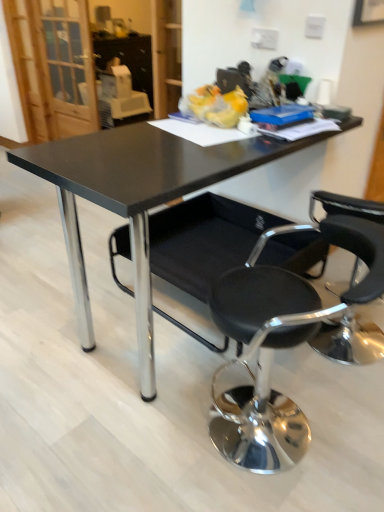
Question: Is black leather chair at lower right, which is counted as the 2th chair, starting from the back, inside the boundaries of black fabric chair at center, which is counted as the 1th chair, starting from the back, or outside?

Choices:
 (A) outside
 (B) inside

Answer: (A)

Question: Looking at their shapes, would you say black leather chair at lower right, which is counted as the 2th chair, starting from the back, is wider or thinner than black fabric chair at center, the second chair viewed from the front?

Choices:
 (A) thin
 (B) wide

Answer: (A)

Question: Which object is positioned farthest from the black glossy table at center?

Choices:
 (A) black fabric chair at center, which is counted as the 1th chair, starting from the back
 (B) black leather chair at lower right, which is counted as the 2th chair, starting from the back

Answer: (B)

Question: Estimate the real-world distances between objects in this image. Which object is farther from the black glossy table at center?

Choices:
 (A) black leather chair at lower right, which is counted as the 2th chair, starting from the back
 (B) black fabric chair at center, which is counted as the 1th chair, starting from the back

Answer: (A)